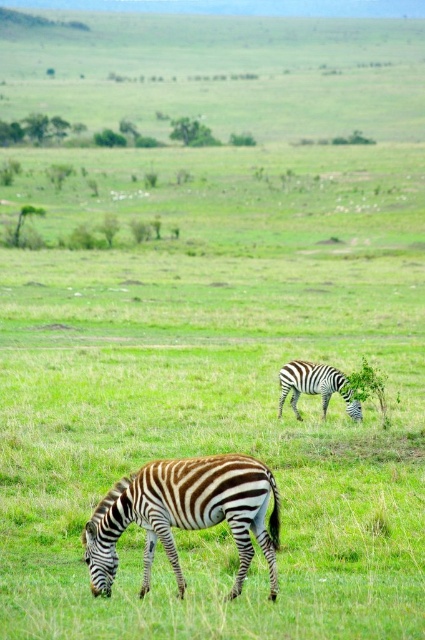
Can you confirm if brown and white striped zebra at lower center is thinner than black and white striped zebra at center?

No.

From the picture: Between brown and white striped zebra at lower center and black and white striped zebra at center, which one is positioned lower?

brown and white striped zebra at lower center

Locate an element on the screen. The height and width of the screenshot is (640, 425). brown and white striped zebra at lower center is located at coordinates (184, 515).

I want to click on brown and white striped zebra at lower center, so click(x=184, y=515).